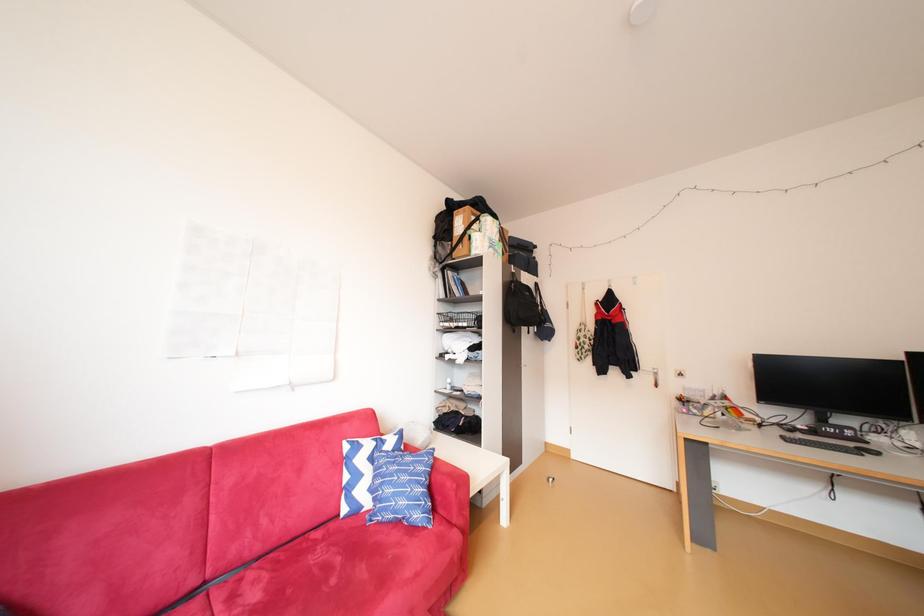
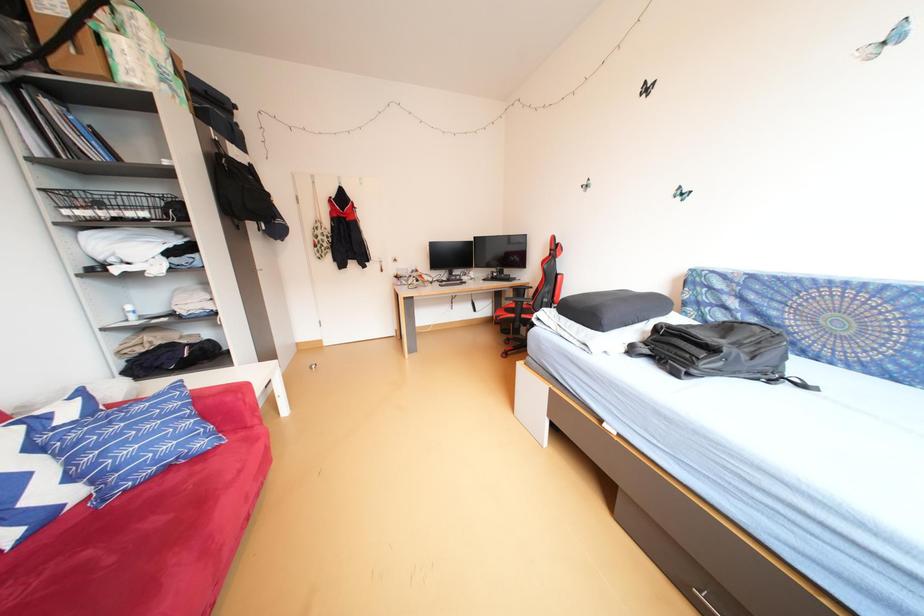
Based on the continuous images, in which direction is the camera rotating?

The rotation direction of the camera is right-down.